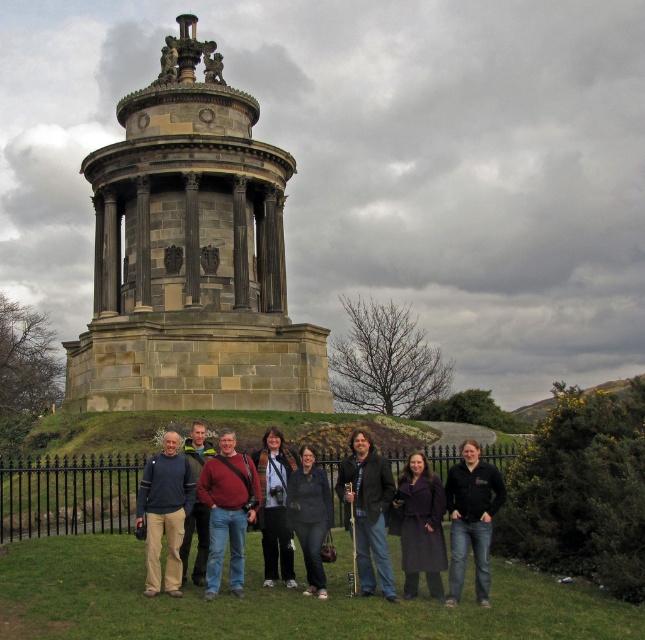
You are a photographer trying to capture a group photo of the people at the monument. You notice the black matte jacket at lower right and the dark gray jacket at center. Which jacket should you focus on to ensure the subject wearing it is fully visible in the frame, considering their jacket size?

The black matte jacket at lower right has a greater width than the dark gray jacket at center, so focusing on the black matte jacket at lower right would ensure the subject is fully visible due to its larger size.

You are a photographer trying to capture a group photo of the people in front of the monument. You notice the black matte jacket at lower right and the dark blue jacket at center. Which jacket should you adjust to ensure both are fully visible in the frame?

The black matte jacket at lower right is shorter than the dark blue jacket at center. To ensure both are fully visible, you should adjust the angle or position so that the shorter black matte jacket at lower right is not blocked by the taller dark blue jacket at center.